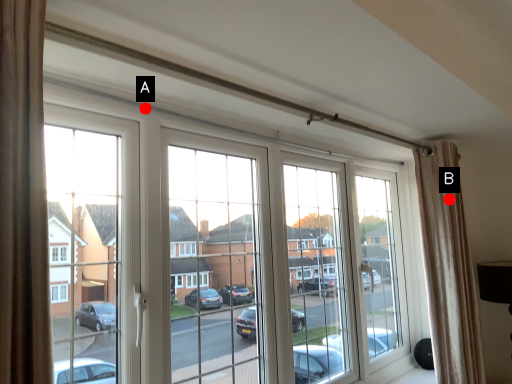
Question: Two points are circled on the image, labeled by A and B beside each circle. Which of the following is the closest to the observer?

Choices:
 (A) A is closer
 (B) B is closer

Answer: (A)